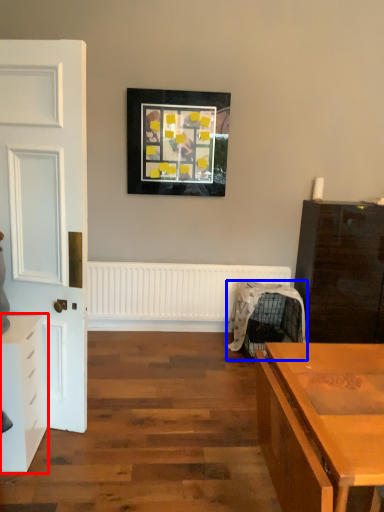
Question: Which of the following is the closest to the observer, chest of drawers (highlighted by a red box) or swivel chair (highlighted by a blue box)?

Choices:
 (A) chest of drawers
 (B) swivel chair

Answer: (A)